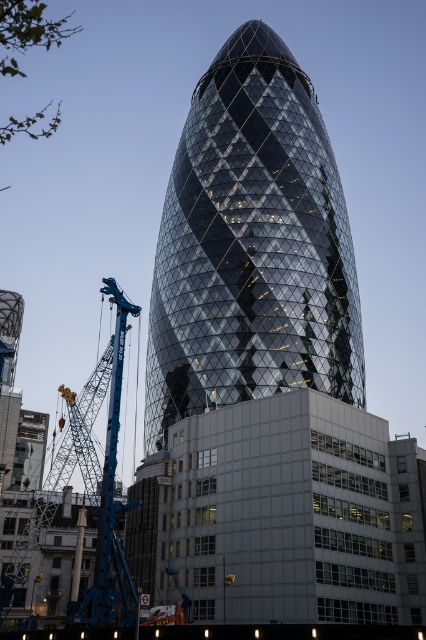
Question: Is glassy steel tower at center thinner than blue metallic crane at left?

Choices:
 (A) yes
 (B) no

Answer: (A)

Question: Is glassy steel tower at center to the right of blue metallic crane at left from the viewer's perspective?

Choices:
 (A) yes
 (B) no

Answer: (A)

Question: Is glassy steel tower at center further to camera compared to blue metallic crane at left?

Choices:
 (A) no
 (B) yes

Answer: (B)

Question: Which point is farther from the camera taking this photo?

Choices:
 (A) (193, 385)
 (B) (23, 426)

Answer: (B)